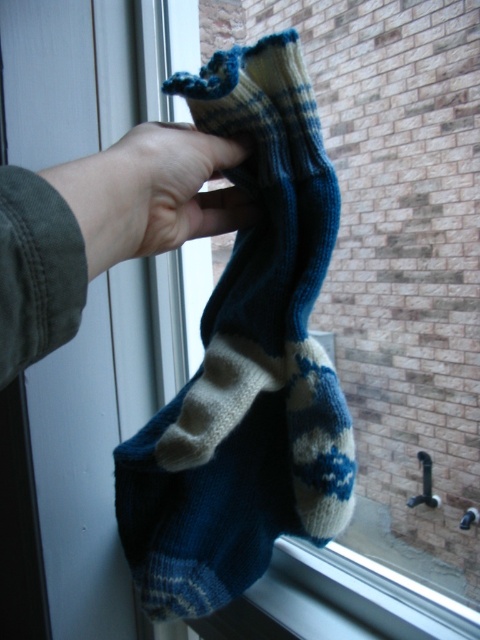
You are a tailor trying to place the blue knitted sock at upper center into a display case. The case has a divider that runs vertically down the middle. If the divider is positioned exactly where the skinny white hand at center is currently holding the sock, will the sock fit entirely to the right of the divider?

The blue knitted sock at upper center is already positioned to the right of the skinny white hand at center. Since the divider is placed where the hand is, the sock would naturally be on the right side of the divider and should fit entirely there as long as the case is wide enough to accommodate its width.